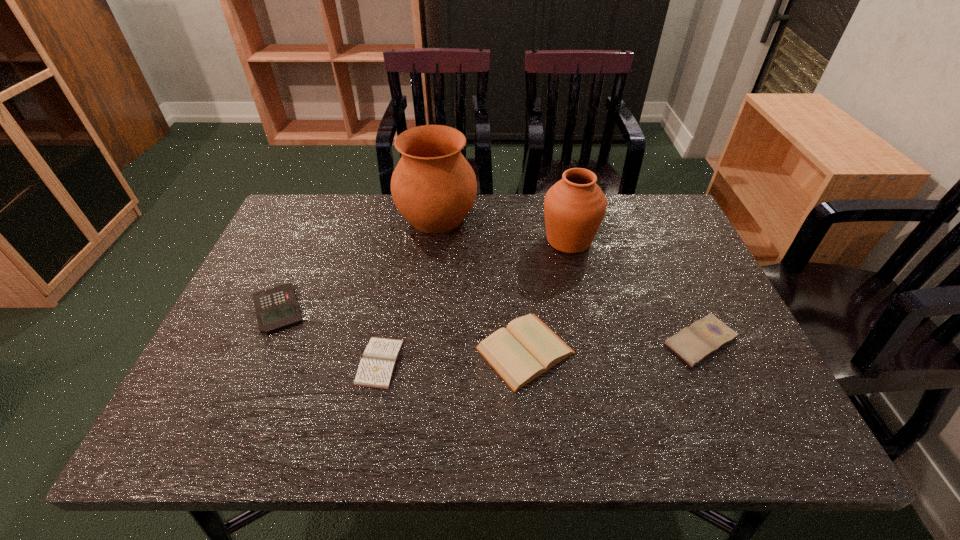
This screenshot has height=540, width=960. What are the coordinates of `free space at the left edge of the desktop` in the screenshot? It's located at (267, 245).

Locate an element on the screen. vacant area at the right edge is located at coordinates (708, 307).

In the image, there is a desktop. Where is `free space at the far left corner`? free space at the far left corner is located at coordinates (300, 208).

Image resolution: width=960 pixels, height=540 pixels. Identify the location of vacant space at the near right corner of the desktop. (721, 442).

The width and height of the screenshot is (960, 540). Identify the location of unoccupied area between the pottery and the rightmost diary. (568, 279).

Identify the location of vacant space that is in between the pottery and the fifth shortest object. Image resolution: width=960 pixels, height=540 pixels. (503, 228).

At what (x,y) coordinates should I click in order to perform the action: click on vacant space that is in between the leftmost object and the shortest diary. Please return your answer as a coordinate pair (x, y). Looking at the image, I should click on (329, 335).

The width and height of the screenshot is (960, 540). I want to click on empty space between the leftmost object and the fifth tallest object, so click(490, 325).

Image resolution: width=960 pixels, height=540 pixels. What are the coordinates of `free space between the second diary from left to right and the urn` in the screenshot? It's located at (547, 295).

At what (x,y) coordinates should I click in order to perform the action: click on free space that is in between the second diary from left to right and the tallest object. Please return your answer as a coordinate pair (x, y). This screenshot has width=960, height=540. Looking at the image, I should click on (481, 284).